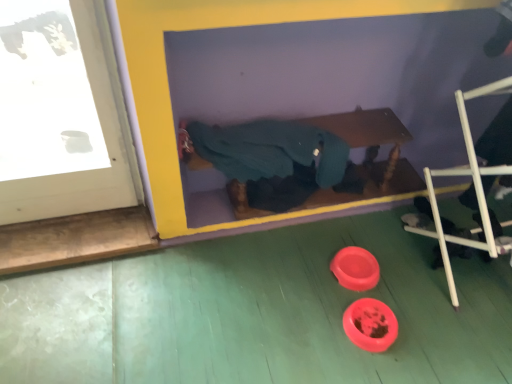
What are the coordinates of `teal fabric at center` in the screenshot? It's located at (268, 160).

The image size is (512, 384). What do you see at coordinates (268, 160) in the screenshot?
I see `teal fabric at center` at bounding box center [268, 160].

Describe the element at coordinates (473, 184) in the screenshot. The height and width of the screenshot is (384, 512). I see `white plastic ladder at lower right` at that location.

Find the location of a particular element. This screenshot has width=512, height=384. white plastic ladder at lower right is located at coordinates (473, 184).

Measure the distance between white plastic ladder at lower right and camera.

The distance of white plastic ladder at lower right from camera is 1.26 meters.

Where is `teal fabric at center`? This screenshot has width=512, height=384. teal fabric at center is located at coordinates (268, 160).

Can you confirm if teal fabric at center is positioned to the left of white plastic ladder at lower right?

Indeed, teal fabric at center is positioned on the left side of white plastic ladder at lower right.

Which object is closer to the camera, teal fabric at center or white plastic ladder at lower right?

white plastic ladder at lower right is more forward.

Is point (193, 138) more distant than point (475, 189)?

No, (193, 138) is in front of (475, 189).

From the image's perspective, does teal fabric at center appear lower than white plastic ladder at lower right?

Incorrect, from the image's perspective, teal fabric at center is higher than white plastic ladder at lower right.

From a real-world perspective, is teal fabric at center positioned above or below white plastic ladder at lower right?

teal fabric at center is below white plastic ladder at lower right.

Looking at this image, considering the relative sizes of teal fabric at center and white plastic ladder at lower right in the image provided, is teal fabric at center thinner than white plastic ladder at lower right?

Correct, the width of teal fabric at center is less than that of white plastic ladder at lower right.

Considering the sizes of objects teal fabric at center and white plastic ladder at lower right in the image provided, who is shorter, teal fabric at center or white plastic ladder at lower right?

teal fabric at center.

Can you confirm if teal fabric at center is smaller than white plastic ladder at lower right?

Indeed, teal fabric at center has a smaller size compared to white plastic ladder at lower right.

Is white plastic ladder at lower right inside teal fabric at center?

No, white plastic ladder at lower right is not surrounded by teal fabric at center.

Would you consider teal fabric at center to be distant from white plastic ladder at lower right?

They are positioned close to each other.

Could you tell me if teal fabric at center is turned towards white plastic ladder at lower right?

No, teal fabric at center is not turned towards white plastic ladder at lower right.

You are a GUI agent. You are given a task and a screenshot of the screen. Output one action in this format:
    pyautogui.click(x=<x>, y=<y>)
    Task: Click on the person below the white plastic ladder at lower right (from a real-world perspective)
    
    Given the screenshot: What is the action you would take?
    pyautogui.click(x=268, y=160)

Which is more to the right, white plastic ladder at lower right or teal fabric at center?

white plastic ladder at lower right is more to the right.

Is white plastic ladder at lower right in front of or behind teal fabric at center in the image?

In the image, white plastic ladder at lower right appears in front of teal fabric at center.

Does point (492, 249) come in front of point (272, 142)?

That is True.

From the image's perspective, is white plastic ladder at lower right beneath teal fabric at center?

Correct, white plastic ladder at lower right appears lower than teal fabric at center in the image.

From a real-world perspective, is white plastic ladder at lower right on top of teal fabric at center?

Yes, from a real-world perspective, white plastic ladder at lower right is over teal fabric at center

Considering the relative sizes of white plastic ladder at lower right and teal fabric at center in the image provided, is white plastic ladder at lower right thinner than teal fabric at center?

No, white plastic ladder at lower right is not thinner than teal fabric at center.

Is white plastic ladder at lower right shorter than teal fabric at center?

In fact, white plastic ladder at lower right may be taller than teal fabric at center.

Is white plastic ladder at lower right smaller than teal fabric at center?

No, white plastic ladder at lower right is not smaller than teal fabric at center.

Is white plastic ladder at lower right situated inside teal fabric at center or outside?

white plastic ladder at lower right exists outside the volume of teal fabric at center.

Does white plastic ladder at lower right touch teal fabric at center?

They are not placed beside each other.

Is teal fabric at center at the back of white plastic ladder at lower right?

That's not correct — white plastic ladder at lower right is not looking away from teal fabric at center.

In order to click on furniture above the teal fabric at center (from a real-world perspective) in this screenshot , I will do `click(473, 184)`.

You are a GUI agent. You are given a task and a screenshot of the screen. Output one action in this format:
    pyautogui.click(x=<x>, y=<y>)
    Task: Click on the person behind the white plastic ladder at lower right
    The height and width of the screenshot is (384, 512).
    Given the screenshot: What is the action you would take?
    [268, 160]

Locate an element on the screen. person above the white plastic ladder at lower right (from the image's perspective) is located at coordinates (268, 160).